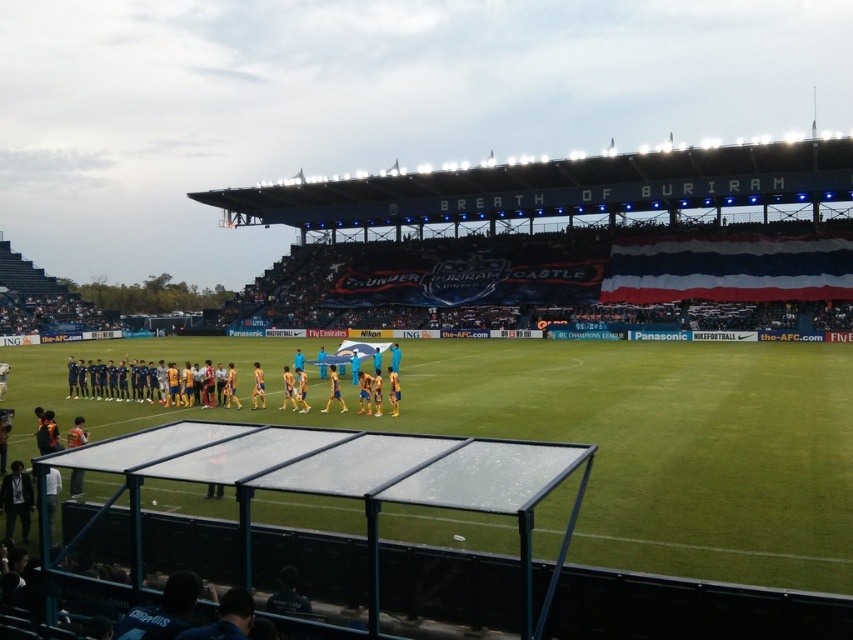
Question: Does green grass football field at center appear on the left side of dark blue jersey at center?

Choices:
 (A) no
 (B) yes

Answer: (A)

Question: Which point is closer to the camera?

Choices:
 (A) dark blue jersey at center
 (B) green grass football field at center

Answer: (B)

Question: Is green grass football field at center bigger than dark blue jersey at center?

Choices:
 (A) yes
 (B) no

Answer: (A)

Question: Which point is closer to the camera?

Choices:
 (A) (271, 401)
 (B) (769, 561)

Answer: (B)

Question: Can you confirm if green grass football field at center is positioned to the left of dark blue jersey at center?

Choices:
 (A) no
 (B) yes

Answer: (A)

Question: Among these points, which one is nearest to the camera?

Choices:
 (A) (741, 426)
 (B) (173, 348)

Answer: (A)